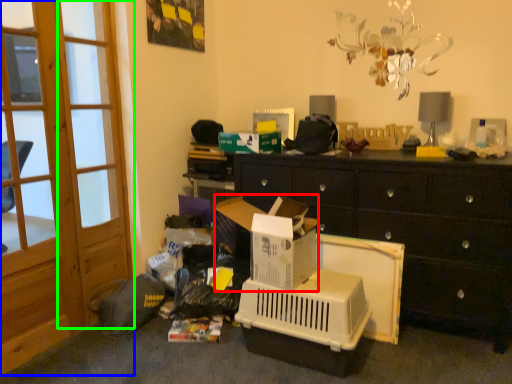
Question: Which object is the closest to the cardboard box (highlighted by a red box)? Choose among these: screen door (highlighted by a blue box) or screen door (highlighted by a green box).

Choices:
 (A) screen door
 (B) screen door

Answer: (A)